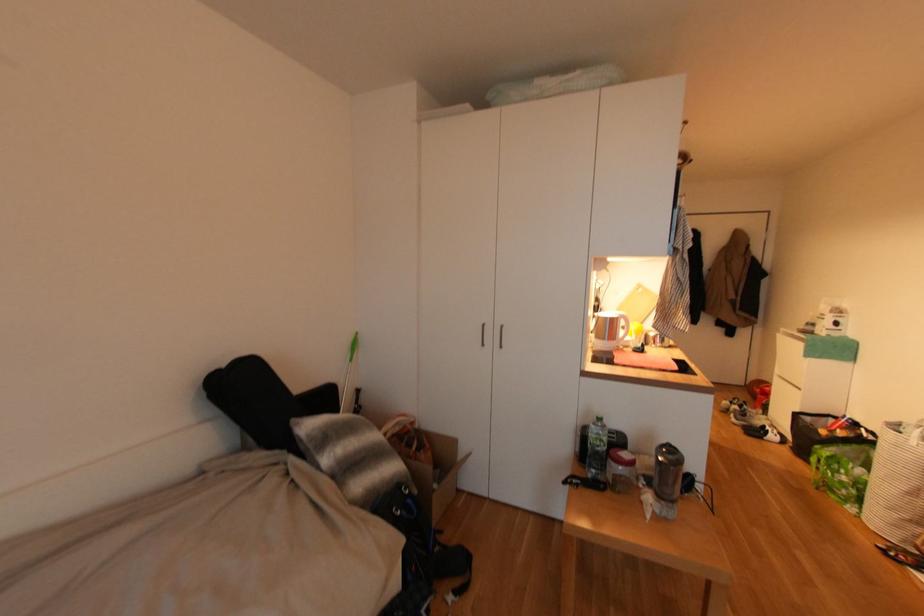
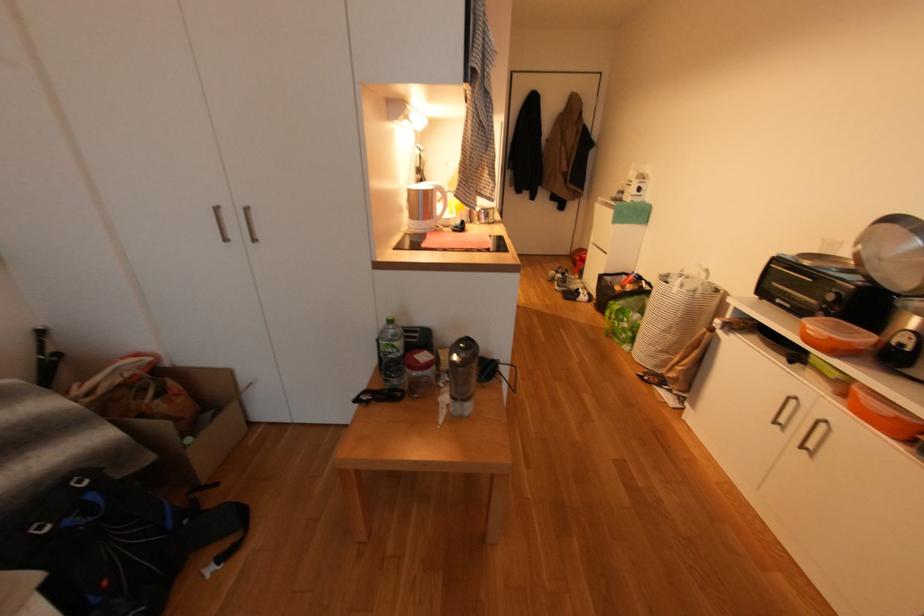
Based on the continuous images, in which direction is the camera rotating?

The camera rotated toward right-down.